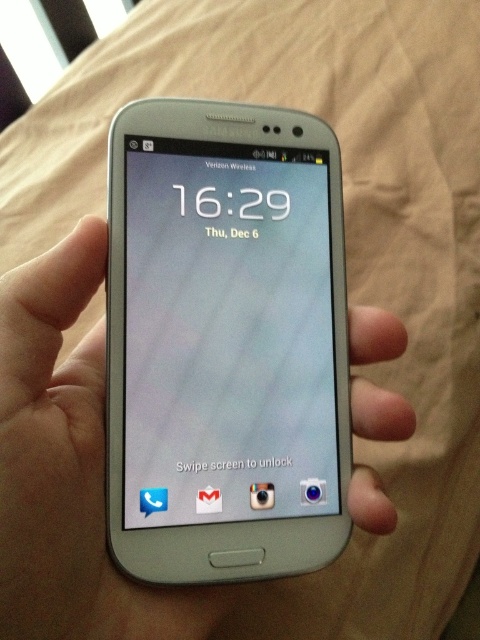
Question: From the image, what is the correct spatial relationship of satin silver phone at center in relation to silver metallic phone at center?

Choices:
 (A) left
 (B) right

Answer: (B)

Question: Does satin silver phone at center lie behind silver metallic phone at center?

Choices:
 (A) yes
 (B) no

Answer: (A)

Question: Can you confirm if satin silver phone at center is positioned to the left of silver metallic phone at center?

Choices:
 (A) yes
 (B) no

Answer: (B)

Question: Among these objects, which one is farthest from the camera?

Choices:
 (A) satin silver phone at center
 (B) silver metallic phone at center

Answer: (A)

Question: Which point is closer to the camera taking this photo?

Choices:
 (A) (325, 321)
 (B) (74, 285)

Answer: (B)

Question: Which object appears farthest from the camera in this image?

Choices:
 (A) silver metallic phone at center
 (B) satin silver phone at center

Answer: (B)